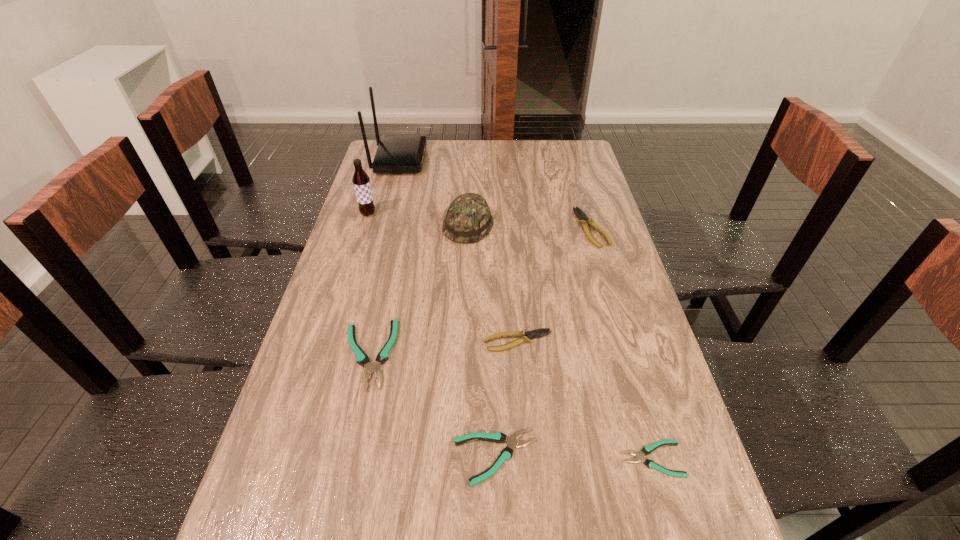
Where is `the second closest object relative to the farthest teal pliers`? The image size is (960, 540). the second closest object relative to the farthest teal pliers is located at coordinates coord(525,336).

Identify which object is the nearest to the leftmost pliers. Please provide its 2D coordinates. Your answer should be formatted as a tuple, i.e. [(x, y)], where the tuple contains the x and y coordinates of a point satisfying the conditions above.

[(506, 454)]

Identify the location of pliers that can be found as the third closest to the farthest teal pliers. (646, 450).

Locate which pliers is the second closest to the farthest object. Please provide its 2D coordinates. Your answer should be formatted as a tuple, i.e. [(x, y)], where the tuple contains the x and y coordinates of a point satisfying the conditions above.

[(362, 359)]

Where is `teal pliers that is the second closest to the root beer`? This screenshot has width=960, height=540. teal pliers that is the second closest to the root beer is located at coordinates (506, 454).

You are a GUI agent. You are given a task and a screenshot of the screen. Output one action in this format:
    pyautogui.click(x=<x>, y=<y>)
    Task: Click on the teal pliers identified as the second closest to the shortest pliers
    The image size is (960, 540).
    Given the screenshot: What is the action you would take?
    pyautogui.click(x=362, y=359)

At what (x,y) coordinates should I click in order to perform the action: click on blank area in the image that satisfies the following two spatial constraints: 1. on the front-facing side of the router; 2. on the back side of the smallest teal pliers. Please return your answer as a coordinate pair (x, y). Looking at the image, I should click on (322, 459).

Locate an element on the screen. The width and height of the screenshot is (960, 540). blank area in the image that satisfies the following two spatial constraints: 1. on the front-facing side of the farthest object; 2. on the back side of the biggest teal pliers is located at coordinates (348, 354).

This screenshot has height=540, width=960. In order to click on free location that satisfies the following two spatial constraints: 1. on the front side of the biggest teal pliers; 2. on the left side of the brown root beer in this screenshot , I will do `click(324, 354)`.

At what (x,y) coordinates should I click in order to perform the action: click on vacant space that satisfies the following two spatial constraints: 1. on the front-facing side of the farthest object; 2. on the back side of the rightmost teal pliers. Please return your answer as a coordinate pair (x, y). This screenshot has width=960, height=540. Looking at the image, I should click on (322, 459).